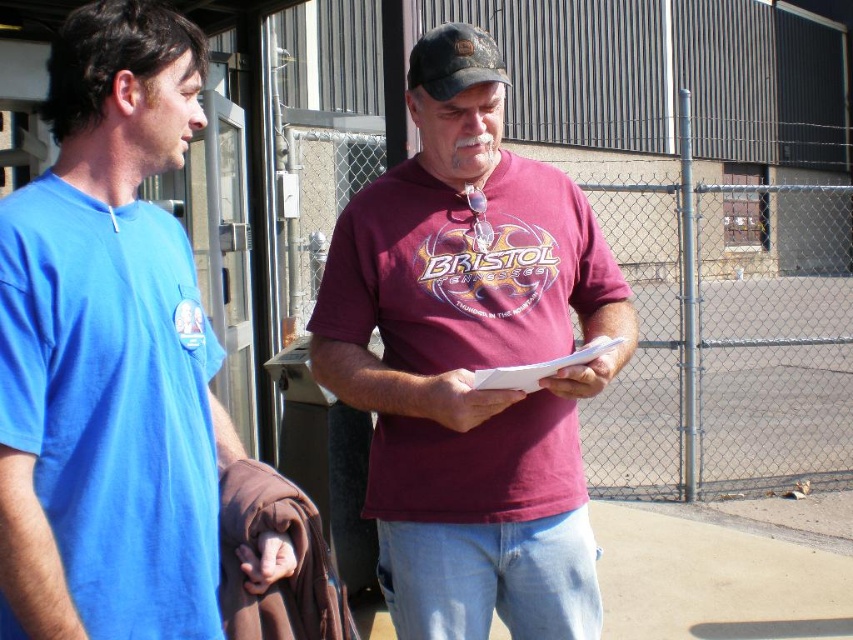
Between blue cotton shirt at left and metallic chain-link fence at center-right, which one has more height?

metallic chain-link fence at center-right

Can you confirm if blue cotton shirt at left is positioned above metallic chain-link fence at center-right?

No.

Does point (112, 376) come farther from viewer compared to point (671, 428)?

That is False.

You are a GUI agent. You are given a task and a screenshot of the screen. Output one action in this format:
    pyautogui.click(x=<x>, y=<y>)
    Task: Click on the blue cotton shirt at left
    The image size is (853, 640).
    Given the screenshot: What is the action you would take?
    pyautogui.click(x=109, y=352)

Is point (505, 468) closer to camera compared to point (468, 29)?

No, it is not.

Is maroon t-shirt at center thinner than black fabric baseball cap at center?

No.

Which is behind, point (582, 266) or point (415, 77)?

Positioned behind is point (582, 266).

Locate an element on the screen. This screenshot has height=640, width=853. maroon t-shirt at center is located at coordinates (471, 374).

Looking at this image, is maroon t-shirt at center shorter than metallic chain-link fence at center-right?

Indeed, maroon t-shirt at center has a lesser height compared to metallic chain-link fence at center-right.

Is maroon t-shirt at center to the left of metallic chain-link fence at center-right from the viewer's perspective?

Indeed, maroon t-shirt at center is positioned on the left side of metallic chain-link fence at center-right.

Describe the element at coordinates (471, 374) in the screenshot. I see `maroon t-shirt at center` at that location.

Locate an element on the screen. maroon t-shirt at center is located at coordinates (471, 374).